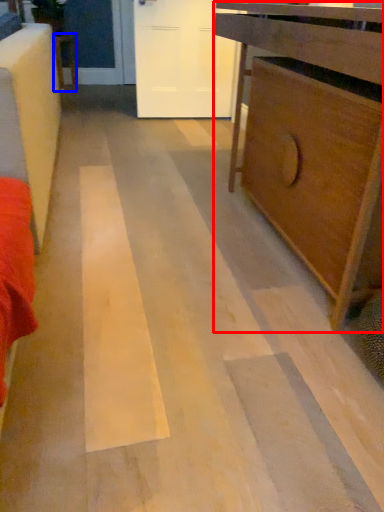
Question: Which point is further to the camera, chest of drawers (highlighted by a red box) or furniture (highlighted by a blue box)?

Choices:
 (A) chest of drawers
 (B) furniture

Answer: (B)